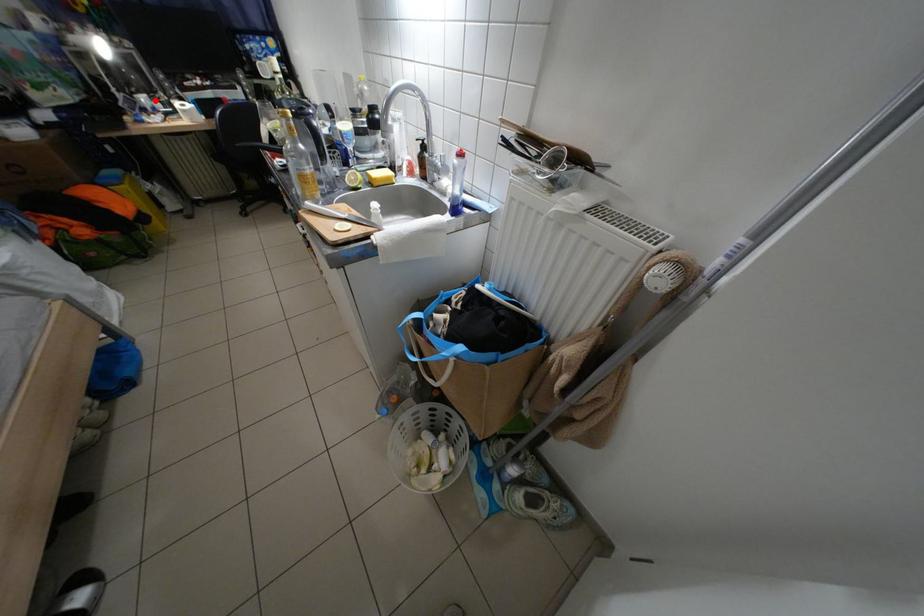
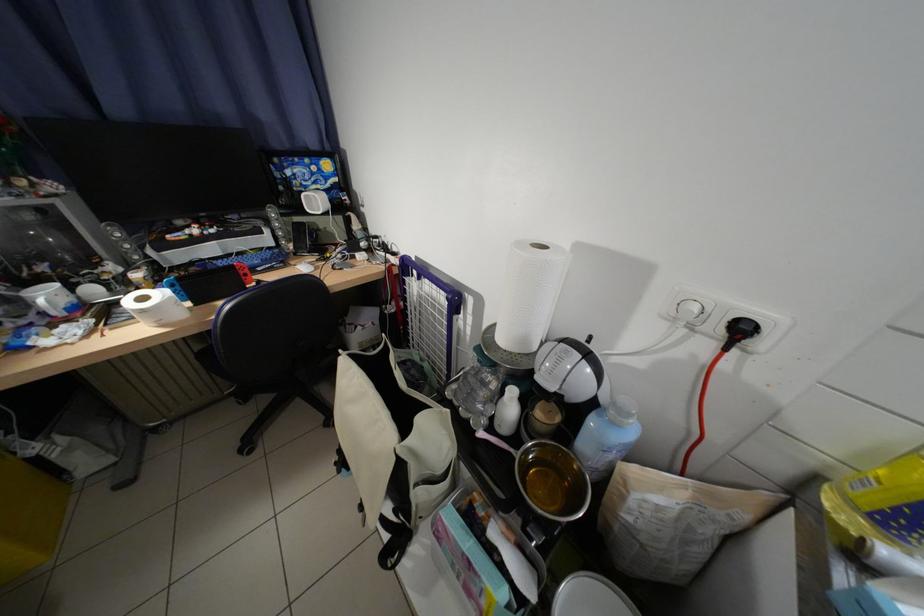
Question: A red point is marked in image1. In image2, is the corresponding 3D point closer to the camera or farther? Reply with the corresponding letter.

Choices:
 (A) The corresponding 3D point is closer.
 (B) The corresponding 3D point is farther.

Answer: (A)